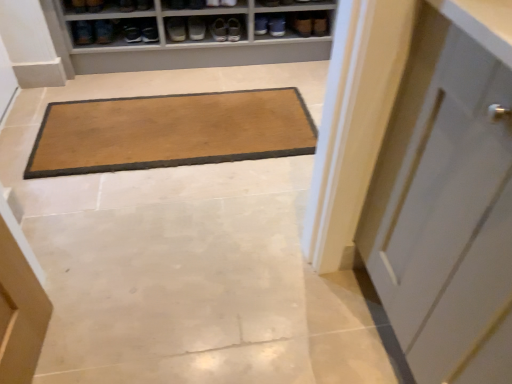
Question: Is brown suede shoe at upper left, marked as the 1th shoe in a left-to-right arrangement, looking in the opposite direction of brown suede shoe at upper center, which ranks as the first shoe in right-to-left order?

Choices:
 (A) no
 (B) yes

Answer: (A)

Question: Considering the relative sizes of brown suede shoe at upper left, which ranks as the fifth shoe in right-to-left order, and brown suede shoe at upper center, which ranks as the first shoe in right-to-left order, in the image provided, is brown suede shoe at upper left, which ranks as the fifth shoe in right-to-left order, smaller than brown suede shoe at upper center, which ranks as the first shoe in right-to-left order,?

Choices:
 (A) no
 (B) yes

Answer: (B)

Question: Is brown suede shoe at upper left, marked as the 1th shoe in a left-to-right arrangement, to the right of brown suede shoe at upper center, which is the fifth shoe from left to right, from the viewer's perspective?

Choices:
 (A) yes
 (B) no

Answer: (B)

Question: Does brown suede shoe at upper left, marked as the 1th shoe in a left-to-right arrangement, have a lesser width compared to brown suede shoe at upper center, which ranks as the first shoe in right-to-left order?

Choices:
 (A) yes
 (B) no

Answer: (A)

Question: Is brown suede shoe at upper left, marked as the 1th shoe in a left-to-right arrangement, taller than brown suede shoe at upper center, which is the fifth shoe from left to right?

Choices:
 (A) yes
 (B) no

Answer: (A)

Question: Is brown suede shoe at upper left, which ranks as the fifth shoe in right-to-left order, to the left or to the right of matte black shoe at upper left, which is counted as the third footwear, starting from the left, in the image?

Choices:
 (A) left
 (B) right

Answer: (A)

Question: Is point (76, 1) positioned closer to the camera than point (131, 23)?

Choices:
 (A) closer
 (B) farther

Answer: (A)

Question: Is brown suede shoe at upper left, marked as the 1th shoe in a left-to-right arrangement, inside or outside of matte black shoe at upper left, which is counted as the third footwear, starting from the left?

Choices:
 (A) outside
 (B) inside

Answer: (A)

Question: Looking at the image, does brown suede shoe at upper left, which ranks as the fifth shoe in right-to-left order, seem bigger or smaller compared to matte black shoe at upper left, which is counted as the third footwear, starting from the left?

Choices:
 (A) big
 (B) small

Answer: (B)

Question: Is matte black shoe at upper center, which ranks as the second shoe in right-to-left order, wider or thinner than matte brown shoe at upper center, which ranks as the 3th shoe in right-to-left order?

Choices:
 (A) wide
 (B) thin

Answer: (B)

Question: Considering their positions, is matte black shoe at upper center, which ranks as the second shoe in right-to-left order, located in front of or behind matte brown shoe at upper center, which ranks as the 3th shoe in right-to-left order?

Choices:
 (A) behind
 (B) front

Answer: (A)

Question: In terms of size, does matte black shoe at upper center, arranged as the 4th shoe when viewed from the left, appear bigger or smaller than matte brown shoe at upper center, which ranks as the 3th shoe in right-to-left order?

Choices:
 (A) small
 (B) big

Answer: (A)

Question: Is point (141, 1) closer or farther from the camera than point (121, 9)?

Choices:
 (A) closer
 (B) farther

Answer: (A)

Question: Based on their sizes in the image, would you say matte black shoe at upper center, arranged as the 4th shoe when viewed from the left, is bigger or smaller than matte gray shoe at upper center, which ranks as the first footwear in right-to-left order?

Choices:
 (A) small
 (B) big

Answer: (B)

Question: Is matte black shoe at upper center, which ranks as the second shoe in right-to-left order, inside the boundaries of matte gray shoe at upper center, which ranks as the first footwear in right-to-left order, or outside?

Choices:
 (A) outside
 (B) inside

Answer: (A)